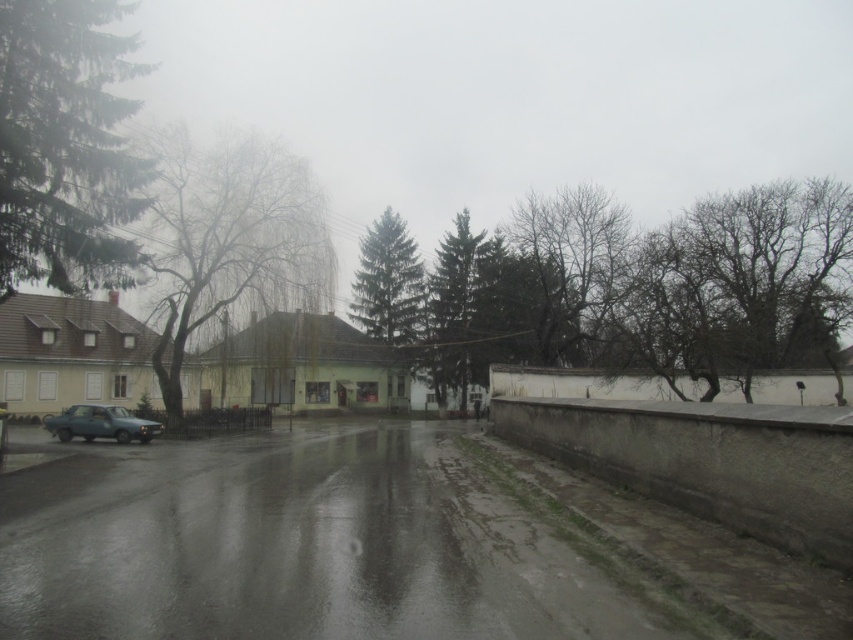
You are a pedestrian standing on the road and looking towards the yellowish building. Which green matte tree is closer to the road, the green matte tree at left or the green matte tree at center?

The green matte tree at left is closer to the road because it is positioned below the green matte tree at center, indicating it is in a lower, more forward position.

Looking at this image, you are standing at the point marked by the coordinates point (228, 241) in the image, which is near a green leafy tree at left. You want to walk to the blue car parked in front of the yellowish building with a sloped roof on the left side of the image. Which direction should you head to reach the blue car?

To reach the blue car parked in front of the yellowish building with a sloped roof on the left side of the image from the point marked by the coordinates point (228, 241), you should head towards the right. This is because the point is already near the green leafy tree at left, and the blue car is located on the left side of the image, so moving right from the tree would align you with the car.